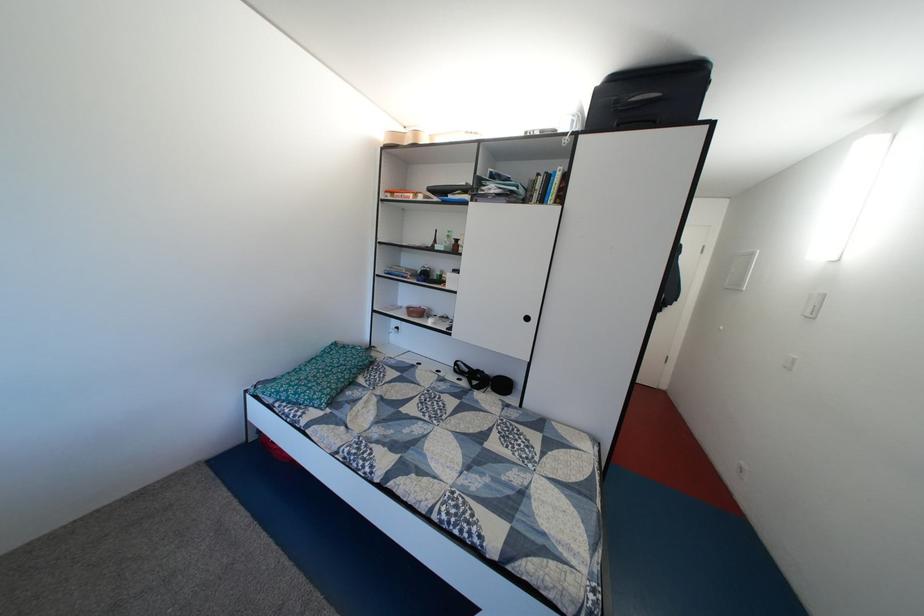
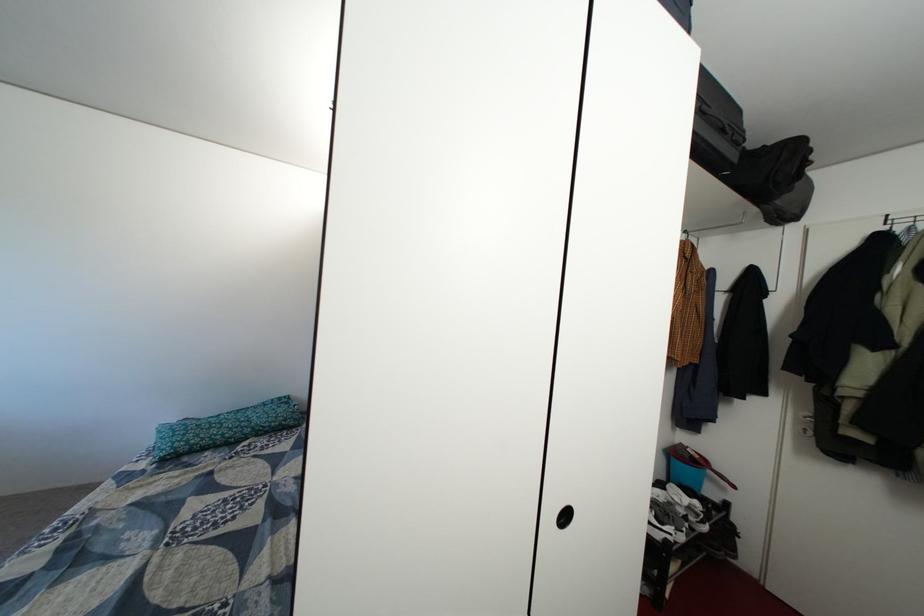
Find the pixel in the second image that matches the point at 337,383 in the first image.

(222, 435)